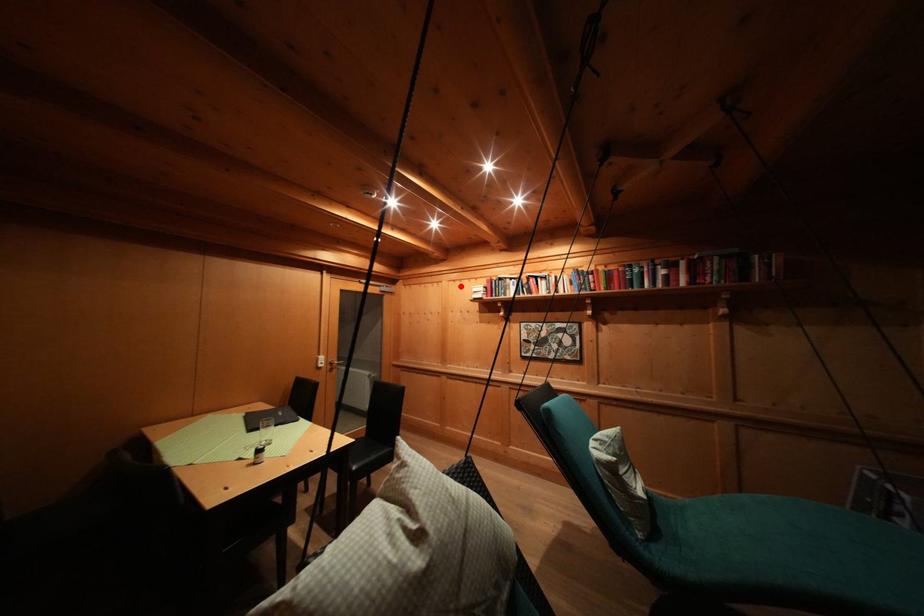
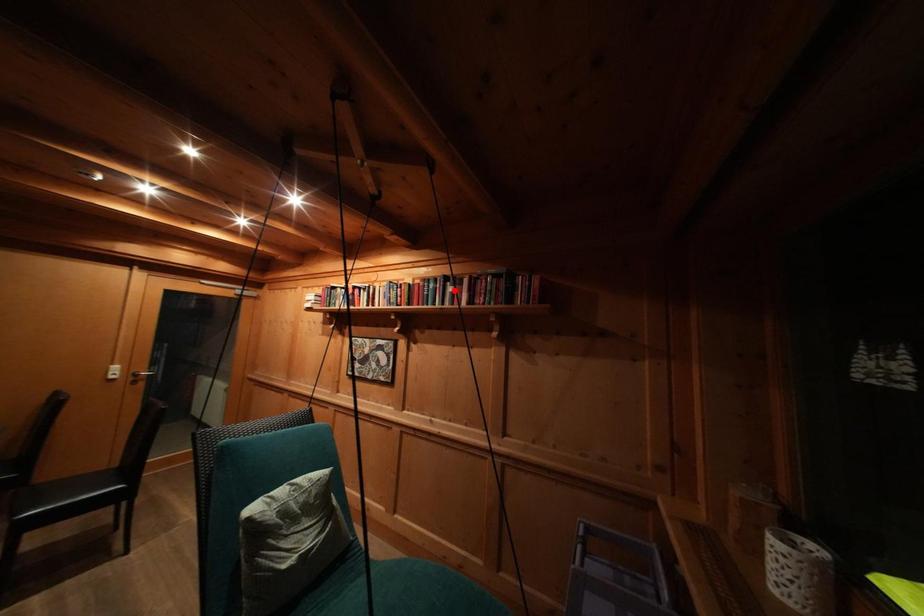
I am providing you with two images of the same scene from different viewpoints. A red point is marked on the first image and another point is marked on the second image. Do the highlighted points in image1 and image2 indicate the same real-world spot?

No